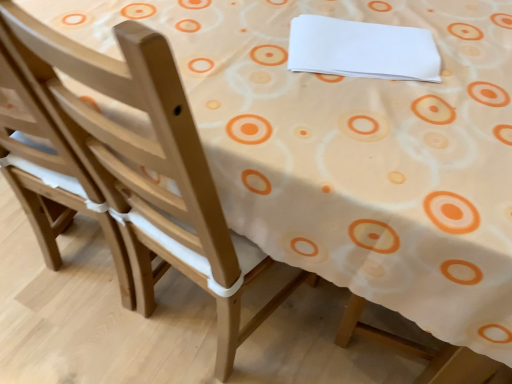
Image resolution: width=512 pixels, height=384 pixels. Find the location of `blank space situated above white paper at upper center (from a real-world perspective)`. blank space situated above white paper at upper center (from a real-world perspective) is located at coordinates (335, 42).